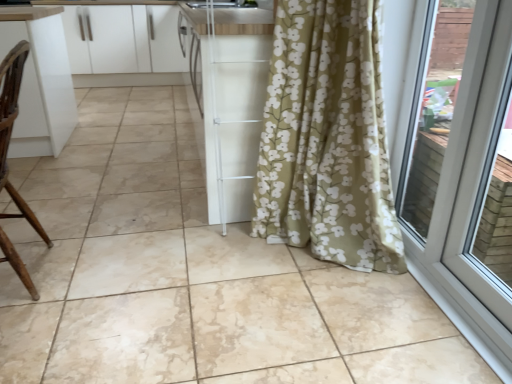
The height and width of the screenshot is (384, 512). I want to click on vacant area situated below brown wood chair at left (from a real-world perspective), so click(x=35, y=271).